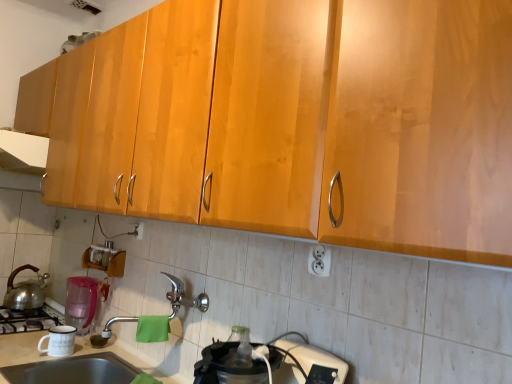
Question: Is white glossy exhaust hood at upper left looking in the opposite direction of shiny metallic tea pot at left?

Choices:
 (A) no
 (B) yes

Answer: (A)

Question: From a real-world perspective, is white glossy exhaust hood at upper left positioned over shiny metallic tea pot at left based on gravity?

Choices:
 (A) no
 (B) yes

Answer: (B)

Question: Can you confirm if white glossy exhaust hood at upper left is taller than shiny metallic tea pot at left?

Choices:
 (A) no
 (B) yes

Answer: (A)

Question: Does white glossy exhaust hood at upper left appear on the right side of shiny metallic tea pot at left?

Choices:
 (A) no
 (B) yes

Answer: (B)

Question: Is white glossy exhaust hood at upper left located outside shiny metallic tea pot at left?

Choices:
 (A) no
 (B) yes

Answer: (B)

Question: Does white glossy exhaust hood at upper left touch shiny metallic tea pot at left?

Choices:
 (A) yes
 (B) no

Answer: (B)

Question: Is pink plastic pitcher at lower left, acting as the 1th appliance starting from the back, facing away from white ceramic mug at lower left, which is counted as the first appliance, starting from the front?

Choices:
 (A) no
 (B) yes

Answer: (A)

Question: Does pink plastic pitcher at lower left, the second appliance positioned from the front, come behind white ceramic mug at lower left, placed as the 2th appliance when sorted from back to front?

Choices:
 (A) no
 (B) yes

Answer: (B)

Question: From a real-world perspective, is pink plastic pitcher at lower left, the second appliance positioned from the front, positioned under white ceramic mug at lower left, placed as the 2th appliance when sorted from back to front, based on gravity?

Choices:
 (A) no
 (B) yes

Answer: (A)

Question: From a real-world perspective, is pink plastic pitcher at lower left, the second appliance positioned from the front, located higher than white ceramic mug at lower left, placed as the 2th appliance when sorted from back to front?

Choices:
 (A) no
 (B) yes

Answer: (B)

Question: Considering the relative positions of pink plastic pitcher at lower left, acting as the 1th appliance starting from the back, and white ceramic mug at lower left, which is counted as the first appliance, starting from the front, in the image provided, is pink plastic pitcher at lower left, acting as the 1th appliance starting from the back, to the right of white ceramic mug at lower left, which is counted as the first appliance, starting from the front, from the viewer's perspective?

Choices:
 (A) no
 (B) yes

Answer: (A)

Question: Is pink plastic pitcher at lower left, the second appliance positioned from the front, next to white ceramic mug at lower left, placed as the 2th appliance when sorted from back to front?

Choices:
 (A) yes
 (B) no

Answer: (B)

Question: Would you consider white plastic outlet at lower center, the second electric outlet from the back, to be distant from silver metallic faucet at center?

Choices:
 (A) no
 (B) yes

Answer: (A)